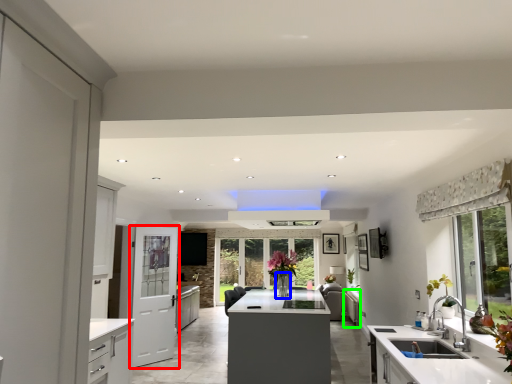
Question: Which object is positioned closest to door (highlighted by a red box)? Select from vase (highlighted by a blue box) and cabinetry (highlighted by a green box).

Choices:
 (A) vase
 (B) cabinetry

Answer: (A)